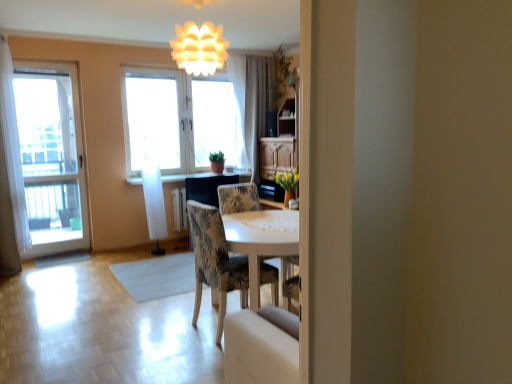
Question: Considering the relative sizes of white sheer curtain at upper center, positioned as the first curtain in right-to-left order, and transparent glass door at left, acting as the 1th window starting from the left, in the image provided, is white sheer curtain at upper center, positioned as the first curtain in right-to-left order, bigger than transparent glass door at left, acting as the 1th window starting from the left,?

Choices:
 (A) no
 (B) yes

Answer: (B)

Question: Can you confirm if white sheer curtain at upper center, which is counted as the second curtain, starting from the front, is positioned to the right of transparent glass door at left, which is the second window from back to front?

Choices:
 (A) yes
 (B) no

Answer: (A)

Question: Could you tell me if white sheer curtain at upper center, positioned as the first curtain in right-to-left order, is turned towards transparent glass door at left, which is the 1th window from front to back?

Choices:
 (A) no
 (B) yes

Answer: (A)

Question: Considering the relative sizes of white sheer curtain at upper center, positioned as the second curtain in left-to-right order, and transparent glass door at left, which is the second window from back to front, in the image provided, is white sheer curtain at upper center, positioned as the second curtain in left-to-right order, smaller than transparent glass door at left, which is the second window from back to front,?

Choices:
 (A) yes
 (B) no

Answer: (B)

Question: Is white sheer curtain at upper center, positioned as the second curtain in left-to-right order, completely or partially outside of transparent glass door at left, which is the second window from back to front?

Choices:
 (A) yes
 (B) no

Answer: (A)

Question: Which is correct: white sheer curtain at upper center, positioned as the second curtain in left-to-right order, is inside transparent glass door at left, which is the 1th window from front to back, or outside of it?

Choices:
 (A) outside
 (B) inside

Answer: (A)

Question: In terms of size, does white sheer curtain at upper center, which is counted as the second curtain, starting from the front, appear bigger or smaller than transparent glass door at left, which is the second window from back to front?

Choices:
 (A) small
 (B) big

Answer: (B)

Question: From the image's perspective, relative to transparent glass door at left, which is the second window from back to front, is white sheer curtain at upper center, positioned as the first curtain in right-to-left order, above or below?

Choices:
 (A) above
 (B) below

Answer: (A)

Question: From their relative heights in the image, would you say white sheer curtain at upper center, which is counted as the second curtain, starting from the front, is taller or shorter than transparent glass door at left, acting as the 1th window starting from the left?

Choices:
 (A) short
 (B) tall

Answer: (A)

Question: Relative to matte black counter top at center, is patterned fabric chair at center in front or behind?

Choices:
 (A) behind
 (B) front

Answer: (B)

Question: Do you think patterned fabric chair at center is within matte black counter top at center, or outside of it?

Choices:
 (A) outside
 (B) inside

Answer: (A)

Question: From the image's perspective, is patterned fabric chair at center located above or below matte black counter top at center?

Choices:
 (A) below
 (B) above

Answer: (A)

Question: Does point (203, 231) appear closer or farther from the camera than point (209, 172)?

Choices:
 (A) closer
 (B) farther

Answer: (A)

Question: From a real-world perspective, is white matte light fixture at upper center physically located above or below transparent glass door at left, acting as the 1th window starting from the left?

Choices:
 (A) below
 (B) above

Answer: (B)

Question: Based on their sizes in the image, would you say white matte light fixture at upper center is bigger or smaller than transparent glass door at left, which is the second window from back to front?

Choices:
 (A) big
 (B) small

Answer: (B)